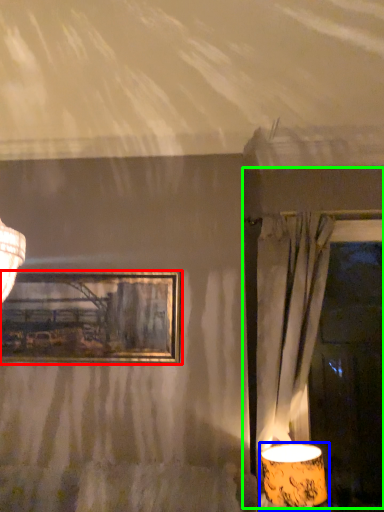
Question: Which is nearer to the picture frame (highlighted by a red box)? lamp (highlighted by a blue box) or window frame (highlighted by a green box).

Choices:
 (A) lamp
 (B) window frame

Answer: (B)